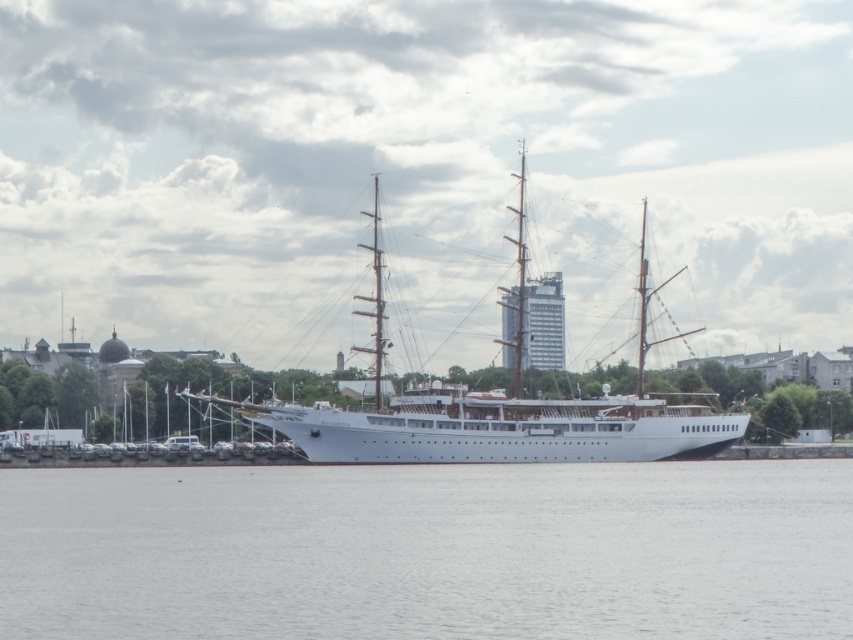
Question: Which object is closer to the camera taking this photo?

Choices:
 (A) white matte ship at center
 (B) clear water at lower center

Answer: (B)

Question: Which object is closer to the camera taking this photo?

Choices:
 (A) clear water at lower center
 (B) white matte ship at center

Answer: (A)

Question: Does clear water at lower center appear under white matte ship at center?

Choices:
 (A) yes
 (B) no

Answer: (A)

Question: Can you confirm if clear water at lower center is positioned to the right of white matte ship at center?

Choices:
 (A) no
 (B) yes

Answer: (A)

Question: Is clear water at lower center below white matte ship at center?

Choices:
 (A) yes
 (B) no

Answer: (A)